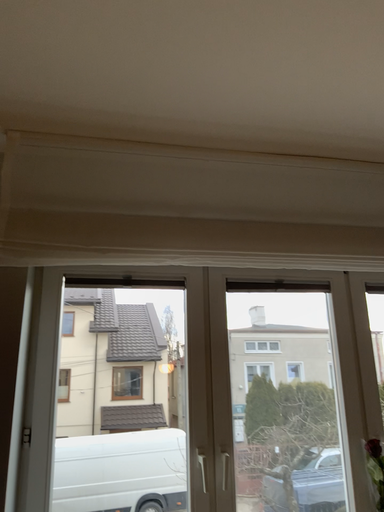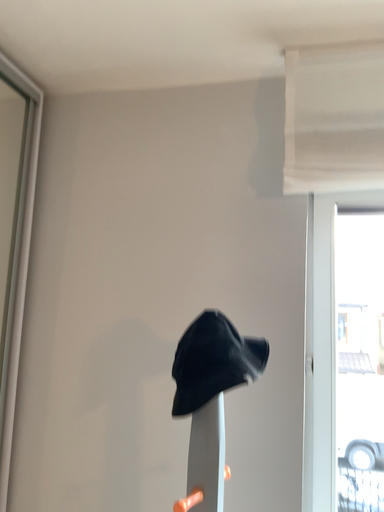
Question: How did the camera likely rotate when shooting the video?

Choices:
 (A) rotated upward
 (B) rotated downward

Answer: (B)